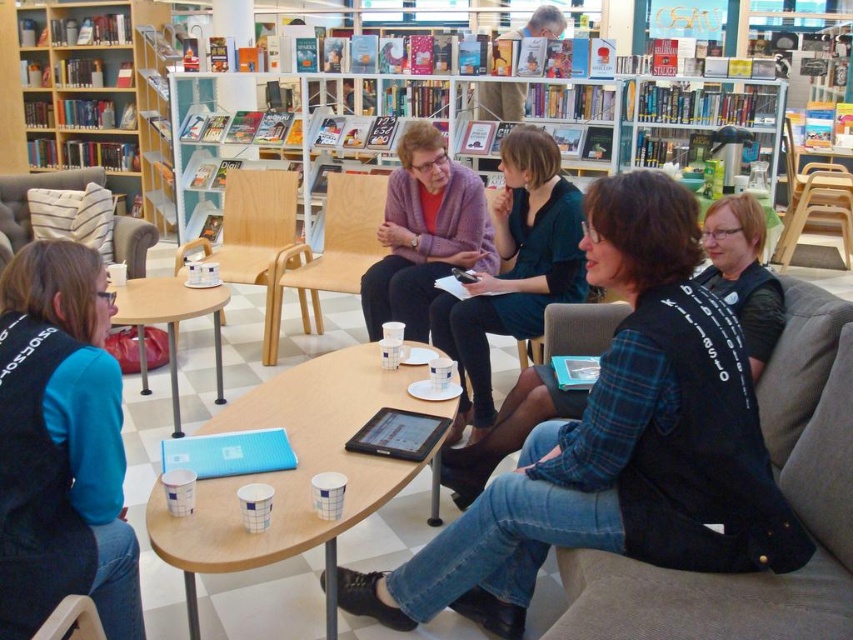
Question: Which point is farther to the camera?

Choices:
 (A) wooden bookshelf at upper center
 (B) wooden chair at lower left
 (C) dark gray fabric couch at lower right
 (D) light wood chair at center

Answer: (A)

Question: Does wooden chair at center lie in front of leather cushioned armchair at left?

Choices:
 (A) no
 (B) yes

Answer: (B)

Question: Can you confirm if black fabric jacket at center is thinner than dark gray fabric couch at lower right?

Choices:
 (A) yes
 (B) no

Answer: (B)

Question: Which object appears closest to the camera in this image?

Choices:
 (A) wooden chair at center
 (B) wooden bookshelf at upper center
 (C) white plastic table at center
 (D) black fabric vest at lower right

Answer: (D)

Question: Estimate the real-world distances between objects in this image. Which object is closer to the wooden chair at lower left?

Choices:
 (A) light wood chair at center
 (B) white paper cup at center
 (C) blue fleece vest at lower left

Answer: (C)

Question: Does purple knit sweater at center come behind light wood chair at center?

Choices:
 (A) yes
 (B) no

Answer: (B)